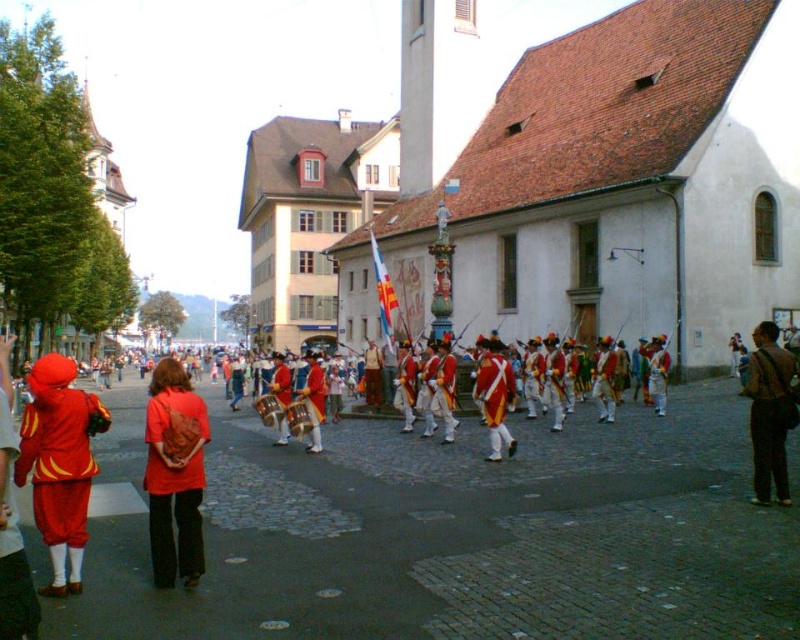
You are standing on the cobblestone street observing the Swiss military reenactment. There are two points marked in the scene, point A at coordinates point [632,579] and point B at coordinates point [758,406]. Which point is nearer to your current position?

Point A at coordinates point [632,579] is closer to the viewer than point B at coordinates point [758,406].

You are a photographer planning to take a group photo of the matte red costume at left and the brown leather jacket at lower right. Which object should you focus on first if you want to ensure both are in focus, considering their sizes?

The matte red costume at left is larger in size than the brown leather jacket at lower right, so you should focus on the matte red costume at left first to ensure both are in focus.

You are a photographer positioned on the cobblestone street, aiming to capture a photo that includes both the matte red costume at left and the brown leather jacket at lower right. Based on their positions, which object should you adjust your camera to focus on first to ensure both are in the frame?

The matte red costume at left is to the left of the brown leather jacket at lower right, so you should focus on the brown leather jacket at lower right first to ensure both are in the frame.